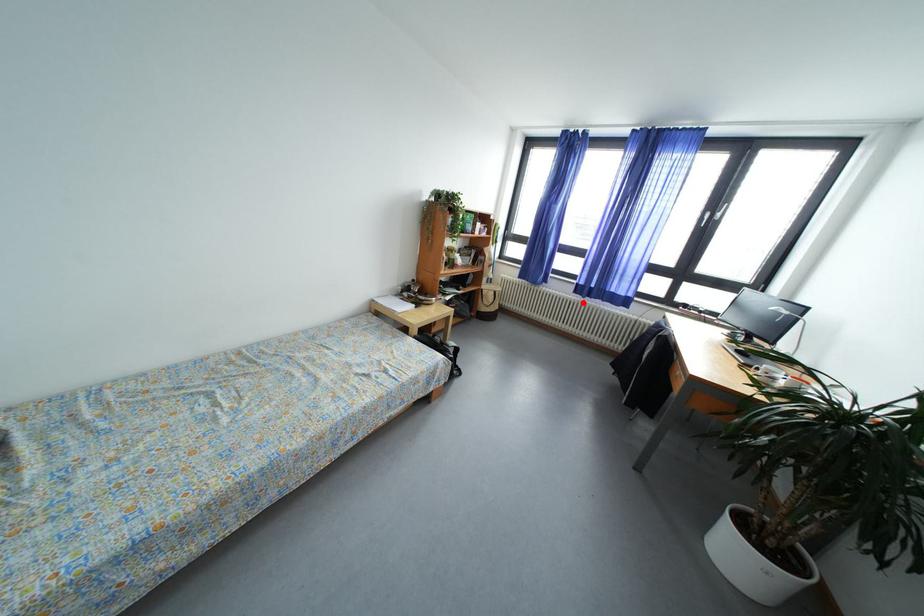
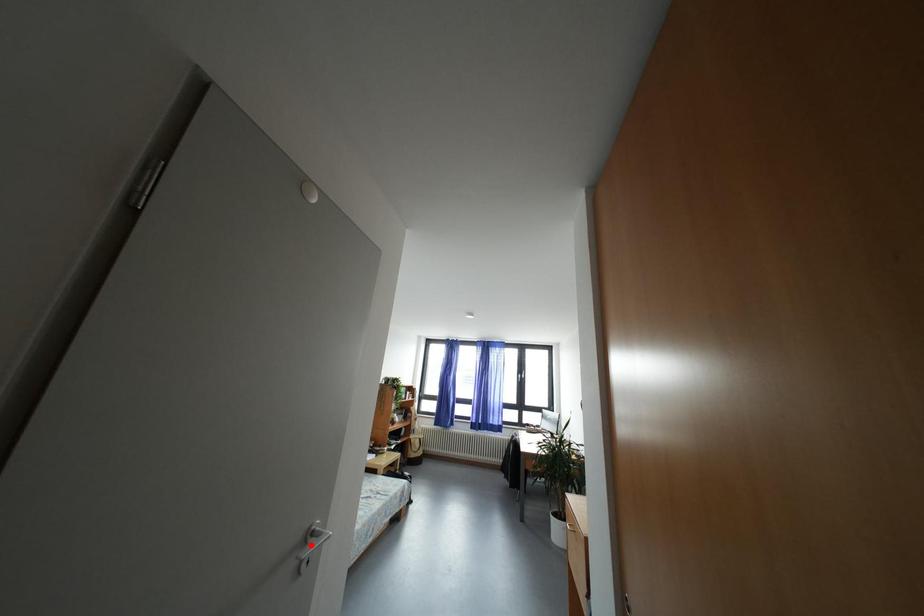
I am providing you with two images of the same scene from different viewpoints. A red point is marked on the first image and another point is marked on the second image. Are the points marked in image1 and image2 representing the same 3D position?

No